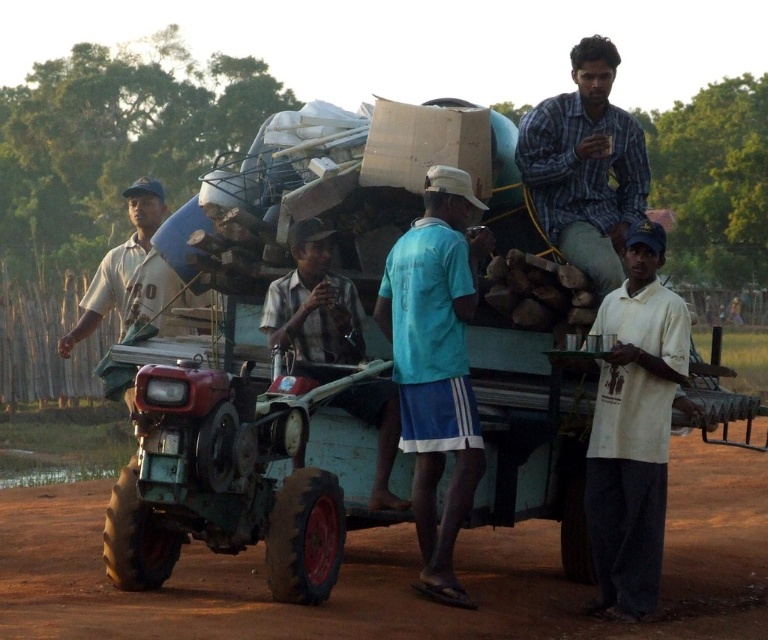
Where is `white cotton shirt at center`? white cotton shirt at center is located at coordinates (634, 428).

What do you see at coordinates (634, 428) in the screenshot? Image resolution: width=768 pixels, height=640 pixels. I see `white cotton shirt at center` at bounding box center [634, 428].

You are a GUI agent. You are given a task and a screenshot of the screen. Output one action in this format:
    pyautogui.click(x=<x>, y=<y>)
    Task: Click on the white cotton shirt at center
    
    Given the screenshot: What is the action you would take?
    pyautogui.click(x=634, y=428)

Who is more forward, (x=392, y=305) or (x=571, y=154)?

Positioned in front is point (x=392, y=305).

Who is lower down, blue fabric shirt at center or plaid shirt at upper right?

Positioned lower is blue fabric shirt at center.

This screenshot has width=768, height=640. What do you see at coordinates (435, 364) in the screenshot? I see `blue fabric shirt at center` at bounding box center [435, 364].

Locate an element on the screen. blue fabric shirt at center is located at coordinates (435, 364).

Based on the photo, can you confirm if blue fabric shirt at center is smaller than white cotton shirt at center?

Yes.

Between point (416, 337) and point (636, 428), which one is positioned in front?

Point (416, 337) is in front.

The image size is (768, 640). Identify the location of blue fabric shirt at center. (435, 364).